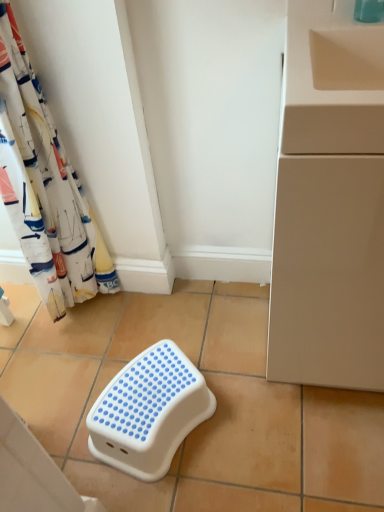
Identify the location of free location above white plastic step stool at center (from a real-world perspective). The width and height of the screenshot is (384, 512). (150, 393).